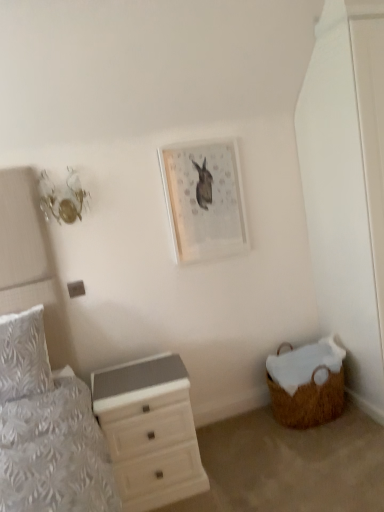
This screenshot has width=384, height=512. What do you see at coordinates (307, 384) in the screenshot?
I see `woven brown basket at lower right` at bounding box center [307, 384].

Measure the distance between point (x=301, y=426) and camera.

Point (x=301, y=426) is 8.26 feet from camera.

Locate an element on the screen. The image size is (384, 512). white glossy chest of drawers at lower left is located at coordinates click(x=149, y=431).

Find the location of a particular element. This screenshot has height=512, width=384. matte white picture frame at upper center is located at coordinates (204, 200).

Which is more to the right, matte white picture frame at upper center or white glossy chest of drawers at lower left?

matte white picture frame at upper center.

Does point (189, 185) lie behind point (117, 446)?

Yes, it is.

Could you measure the distance between matte white picture frame at upper center and white glossy chest of drawers at lower left?

matte white picture frame at upper center and white glossy chest of drawers at lower left are 37.92 inches apart.

In terms of width, does matte white picture frame at upper center look wider or thinner when compared to white glossy chest of drawers at lower left?

In the image, matte white picture frame at upper center appears to be more narrow than white glossy chest of drawers at lower left.

Between woven brown basket at lower right and white textured pillow at left, which one appears on the left side from the viewer's perspective?

white textured pillow at left is more to the left.

Is woven brown basket at lower right oriented away from white textured pillow at left?

That's not correct — woven brown basket at lower right is not looking away from white textured pillow at left.

In the image, is woven brown basket at lower right positioned in front of or behind white textured pillow at left?

In the image, woven brown basket at lower right appears behind white textured pillow at left.

In the scene shown: Measure the distance from woven brown basket at lower right to white textured pillow at left.

woven brown basket at lower right and white textured pillow at left are 1.47 meters apart from each other.

Considering the sizes of objects white textured pillow at left and matte white picture frame at upper center in the image provided, who is shorter, white textured pillow at left or matte white picture frame at upper center?

With less height is white textured pillow at left.

Looking at this image, considering the sizes of white textured pillow at left and matte white picture frame at upper center in the image, is white textured pillow at left bigger or smaller than matte white picture frame at upper center?

Considering their sizes, white textured pillow at left takes up more space than matte white picture frame at upper center.

Considering the relative positions of white textured pillow at left and matte white picture frame at upper center in the image provided, is white textured pillow at left to the left of matte white picture frame at upper center from the viewer's perspective?

Yes.

Is white textured pillow at left far from matte white picture frame at upper center?

Yes.

Is white glossy chest of drawers at lower left surrounded by woven brown basket at lower right?

No, white glossy chest of drawers at lower left is not surrounded by woven brown basket at lower right.

From the image's perspective, is woven brown basket at lower right above or below white glossy chest of drawers at lower left?

Based on their image positions, woven brown basket at lower right is located above white glossy chest of drawers at lower left.

From a real-world perspective, which object rests below the other?

In real-world perspective, woven brown basket at lower right is lower.

In terms of height, does woven brown basket at lower right look taller or shorter compared to white glossy chest of drawers at lower left?

woven brown basket at lower right is shorter than white glossy chest of drawers at lower left.

Are white glossy chest of drawers at lower left and matte white picture frame at upper center far apart?

No, white glossy chest of drawers at lower left is in close proximity to matte white picture frame at upper center.

In the image, is white glossy chest of drawers at lower left positioned in front of or behind matte white picture frame at upper center?

In the image, white glossy chest of drawers at lower left appears in front of matte white picture frame at upper center.

Consider the image. Is white glossy chest of drawers at lower left turned away from matte white picture frame at upper center?

No, white glossy chest of drawers at lower left's orientation is not away from matte white picture frame at upper center.

Which object is thinner, white glossy chest of drawers at lower left or matte white picture frame at upper center?

With smaller width is matte white picture frame at upper center.

Who is bigger, matte white picture frame at upper center or woven brown basket at lower right?

woven brown basket at lower right.

Measure the distance between matte white picture frame at upper center and woven brown basket at lower right.

A distance of 1.00 meters exists between matte white picture frame at upper center and woven brown basket at lower right.

Consider the image. Which is more to the right, matte white picture frame at upper center or woven brown basket at lower right?

From the viewer's perspective, woven brown basket at lower right appears more on the right side.

Considering the relative sizes of matte white picture frame at upper center and woven brown basket at lower right in the image provided, is matte white picture frame at upper center shorter than woven brown basket at lower right?

In fact, matte white picture frame at upper center may be taller than woven brown basket at lower right.

Is woven brown basket at lower right positioned with its back to matte white picture frame at upper center?

No, woven brown basket at lower right's orientation is not away from matte white picture frame at upper center.

From the image's perspective, is woven brown basket at lower right above or below matte white picture frame at upper center?

woven brown basket at lower right is situated lower than matte white picture frame at upper center in the image.

In terms of size, does woven brown basket at lower right appear bigger or smaller than matte white picture frame at upper center?

woven brown basket at lower right is bigger than matte white picture frame at upper center.

Is point (295, 390) in front of point (228, 179)?

Yes, it is.

Find the location of `picture frame behind the white glossy chest of drawers at lower left`. picture frame behind the white glossy chest of drawers at lower left is located at coordinates (204, 200).

Locate an element on the screen. The height and width of the screenshot is (512, 384). pillow above the woven brown basket at lower right (from a real-world perspective) is located at coordinates (23, 356).

Based on their spatial positions, is white glossy chest of drawers at lower left or matte white picture frame at upper center closer to white textured pillow at left?

The object closer to white textured pillow at left is white glossy chest of drawers at lower left.

Estimate the real-world distances between objects in this image. Which object is further from matte white picture frame at upper center, white textured pillow at left or white glossy chest of drawers at lower left?

white textured pillow at left is further to matte white picture frame at upper center.

Considering their positions, is white glossy chest of drawers at lower left positioned closer to white textured pillow at left than woven brown basket at lower right?

Among the two, white glossy chest of drawers at lower left is located nearer to white textured pillow at left.

Based on their spatial positions, is white textured pillow at left or woven brown basket at lower right further from white glossy chest of drawers at lower left?

woven brown basket at lower right lies further to white glossy chest of drawers at lower left than the other object.

Estimate the real-world distances between objects in this image. Which object is further from matte white picture frame at upper center, white glossy chest of drawers at lower left or woven brown basket at lower right?

woven brown basket at lower right is positioned further to the anchor matte white picture frame at upper center.

Considering their positions, is woven brown basket at lower right positioned closer to matte white picture frame at upper center than white textured pillow at left?

woven brown basket at lower right.

Looking at the image, which one is located further to woven brown basket at lower right, matte white picture frame at upper center or white glossy chest of drawers at lower left?

The object further to woven brown basket at lower right is matte white picture frame at upper center.

When comparing their distances from white glossy chest of drawers at lower left, does matte white picture frame at upper center or woven brown basket at lower right seem closer?

woven brown basket at lower right lies closer to white glossy chest of drawers at lower left than the other object.

Locate an element on the screen. basket between matte white picture frame at upper center and white glossy chest of drawers at lower left from top to bottom is located at coordinates point(307,384).

The width and height of the screenshot is (384, 512). I want to click on pillow between matte white picture frame at upper center and white glossy chest of drawers at lower left in the vertical direction, so click(23, 356).

The width and height of the screenshot is (384, 512). In order to click on the chest of drawers situated between white textured pillow at left and woven brown basket at lower right from left to right in this screenshot , I will do `click(149, 431)`.

Locate an element on the screen. The width and height of the screenshot is (384, 512). picture frame located between white textured pillow at left and woven brown basket at lower right in the left-right direction is located at coordinates (204, 200).